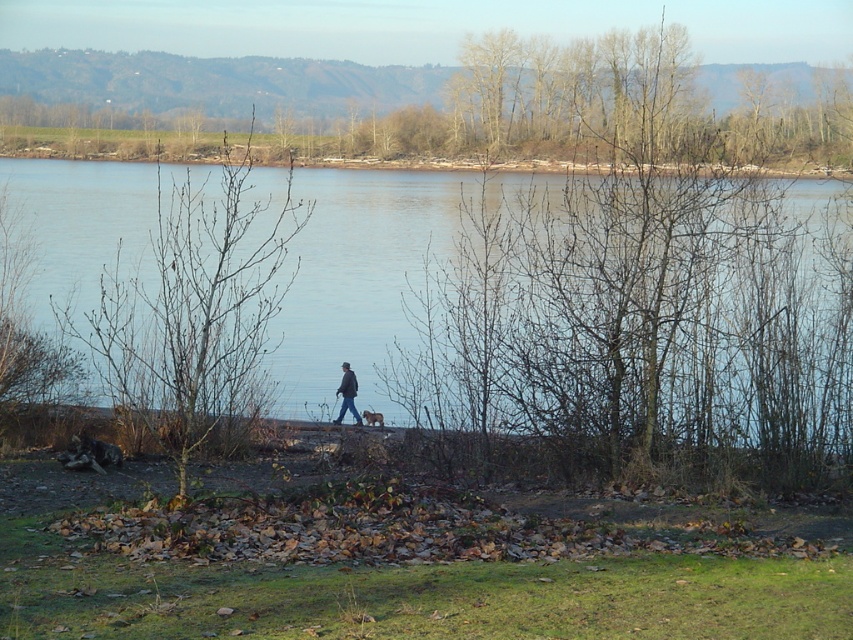
Which is below, blue water at center or brown fur dog at center?

brown fur dog at center is below.

Locate an element on the screen. blue water at center is located at coordinates (471, 300).

Is blue water at center closer to the viewer compared to dark gray jacket at center?

Yes.

Is blue water at center to the right of dark gray jacket at center from the viewer's perspective?

No, blue water at center is not to the right of dark gray jacket at center.

Which is in front, point (759, 243) or point (347, 376)?

Positioned in front is point (759, 243).

Identify the location of blue water at center. This screenshot has width=853, height=640. (471, 300).

Does bare branches at left come behind dark gray jacket at center?

A: No, bare branches at left is in front of dark gray jacket at center.

Between bare branches at left and dark gray jacket at center, which one has more height?

bare branches at left

Which is behind, point (165, 344) or point (355, 392)?

The point (355, 392) is behind.

Identify the location of bare branches at left. This screenshot has height=640, width=853. (193, 310).